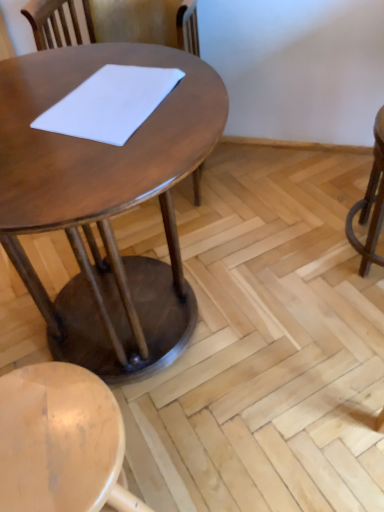
Where is `white matte notepad at center`? The width and height of the screenshot is (384, 512). white matte notepad at center is located at coordinates (110, 103).

Can you tell me how much light wood stool at lower left and white matte notepad at center differ in facing direction?

There is a 81.6-degree angle between the facing directions of light wood stool at lower left and white matte notepad at center.

From the image's perspective, relative to white matte notepad at center, is light wood stool at lower left above or below?

Based on their image positions, light wood stool at lower left is located beneath white matte notepad at center.

Which of these two, light wood stool at lower left or white matte notepad at center, is thinner?

Thinner between the two is white matte notepad at center.

Locate an element on the screen. notepad above the shiny brown table at center (from the image's perspective) is located at coordinates (110, 103).

Based on the photo, is white matte notepad at center outside of shiny brown table at center?

No, white matte notepad at center is inside shiny brown table at center's boundary.

Considering the sizes of objects white matte notepad at center and shiny brown table at center in the image provided, who is shorter, white matte notepad at center or shiny brown table at center?

With less height is white matte notepad at center.

From a real-world perspective, is shiny brown table at center beneath light wood stool at lower left?

Actually, shiny brown table at center is physically above light wood stool at lower left in the real world.

Considering the relative positions of shiny brown table at center and light wood stool at lower left in the image provided, is shiny brown table at center behind light wood stool at lower left?

No, the depth of shiny brown table at center is less than that of light wood stool at lower left.

Is the surface of shiny brown table at center in direct contact with light wood stool at lower left?

shiny brown table at center is not next to light wood stool at lower left, and they're not touching.

Looking at this image, how different are the orientations of shiny brown table at center and light wood stool at lower left in degrees?

There is a 180-degree angle between the facing directions of shiny brown table at center and light wood stool at lower left.

Which is in front, point (111, 496) or point (116, 197)?

Point (116, 197)

Is light wood stool at lower left directly adjacent to shiny brown table at center?

No, light wood stool at lower left is not with shiny brown table at center.

Based on the photo, can you confirm if light wood stool at lower left is positioned to the left of shiny brown table at center?

In fact, light wood stool at lower left is to the right of shiny brown table at center.

Which object is thinner, white matte notepad at center or light wood stool at lower left?

white matte notepad at center.

What are the coordinates of `stool lying below the white matte notepad at center (from the image's perspective)` in the screenshot? It's located at (60, 441).

Is white matte notepad at center not near light wood stool at lower left?

white matte notepad at center is actually quite close to light wood stool at lower left.

Is white matte notepad at center to the left of light wood stool at lower left from the viewer's perspective?

Incorrect, white matte notepad at center is not on the left side of light wood stool at lower left.

Can you tell me how much shiny brown table at center and white matte notepad at center differ in facing direction?

98.4 degrees separate the facing orientations of shiny brown table at center and white matte notepad at center.

Is point (164, 211) more distant than point (168, 68)?

Yes, point (164, 211) is behind point (168, 68).

Considering the sizes of objects shiny brown table at center and white matte notepad at center in the image provided, who is wider, shiny brown table at center or white matte notepad at center?

Wider between the two is shiny brown table at center.

Does shiny brown table at center lie behind white matte notepad at center?

No, it is not.

You are a GUI agent. You are given a task and a screenshot of the screen. Output one action in this format:
    pyautogui.click(x=<x>, y=<y>)
    Task: Click on the stool below the white matte notepad at center (from a real-world perspective)
    
    Given the screenshot: What is the action you would take?
    pyautogui.click(x=60, y=441)

This screenshot has height=512, width=384. Find the location of `table in front of the white matte notepad at center`. table in front of the white matte notepad at center is located at coordinates (105, 204).

Considering their positions, is light wood stool at lower left positioned further to shiny brown table at center than white matte notepad at center?

light wood stool at lower left.

From the image, which object appears to be farther from light wood stool at lower left, shiny brown table at center or white matte notepad at center?

Among the two, white matte notepad at center is located further to light wood stool at lower left.

From the image, which object appears to be farther from shiny brown table at center, white matte notepad at center or light wood stool at lower left?

light wood stool at lower left lies further to shiny brown table at center than the other object.

Estimate the real-world distances between objects in this image. Which object is further from white matte notepad at center, shiny brown table at center or light wood stool at lower left?

light wood stool at lower left is positioned further to the anchor white matte notepad at center.

Based on their spatial positions, is light wood stool at lower left or shiny brown table at center closer to white matte notepad at center?

The object closer to white matte notepad at center is shiny brown table at center.

Considering their positions, is white matte notepad at center positioned further to light wood stool at lower left than shiny brown table at center?

white matte notepad at center lies further to light wood stool at lower left than the other object.

The width and height of the screenshot is (384, 512). In order to click on table between white matte notepad at center and light wood stool at lower left from top to bottom in this screenshot , I will do `click(105, 204)`.